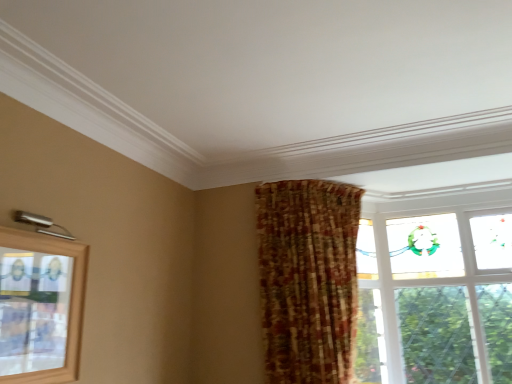
The width and height of the screenshot is (512, 384). Identify the location of plaid fabric curtain at center. (308, 279).

Considering the sizes of plaid fabric curtain at center and clear glass window at upper right, placed as the first window when sorted from right to left, in the image, is plaid fabric curtain at center bigger or smaller than clear glass window at upper right, placed as the first window when sorted from right to left,?

Considering their sizes, plaid fabric curtain at center takes up more space than clear glass window at upper right, placed as the first window when sorted from right to left.

Does plaid fabric curtain at center lie behind clear glass window at upper right, which appears as the 2th window when viewed from the front?

No, plaid fabric curtain at center is closer to the viewer.

Can you confirm if plaid fabric curtain at center is shorter than clear glass window at upper right, which appears as the 2th window when viewed from the front?

Correct, plaid fabric curtain at center is not as tall as clear glass window at upper right, which appears as the 2th window when viewed from the front.

You are a GUI agent. You are given a task and a screenshot of the screen. Output one action in this format:
    pyautogui.click(x=<x>, y=<y>)
    Task: Click on the curtain that appears on the left of clear glass window at upper right, which appears as the 2th window when viewed from the front
    The image size is (512, 384).
    Given the screenshot: What is the action you would take?
    pyautogui.click(x=308, y=279)

From the image's perspective, is clear glass window at upper right, which is the second window in left-to-right order, above plaid fabric curtain at center?

Incorrect, from the image's perspective, clear glass window at upper right, which is the second window in left-to-right order, is lower than plaid fabric curtain at center.

Can you confirm if clear glass window at upper right, which appears as the 2th window when viewed from the front, is smaller than plaid fabric curtain at center?

Indeed, clear glass window at upper right, which appears as the 2th window when viewed from the front, has a smaller size compared to plaid fabric curtain at center.

Which object is wider, clear glass window at upper right, the 1th window positioned from the back, or plaid fabric curtain at center?

plaid fabric curtain at center.

Is clear glass window at upper left, placed as the 1th window when sorted from left to right, inside the boundaries of clear glass window at upper right, which is the second window in left-to-right order, or outside?

clear glass window at upper left, placed as the 1th window when sorted from left to right, cannot be found inside clear glass window at upper right, which is the second window in left-to-right order.

Looking at this image, from the image's perspective, who appears lower, clear glass window at upper left, positioned as the 2th window in back-to-front order, or clear glass window at upper right, the 1th window positioned from the back?

clear glass window at upper right, the 1th window positioned from the back, from the image's perspective.

From a real-world perspective, is clear glass window at upper left, which appears as the 1th window when viewed from the front, physically below clear glass window at upper right, placed as the first window when sorted from right to left?

Yes, from a real-world perspective, clear glass window at upper left, which appears as the 1th window when viewed from the front, is under clear glass window at upper right, placed as the first window when sorted from right to left.

Could you measure the distance between clear glass window at upper left, positioned as the 2th window in back-to-front order, and clear glass window at upper right, placed as the first window when sorted from right to left?

clear glass window at upper left, positioned as the 2th window in back-to-front order, is 7.69 feet from clear glass window at upper right, placed as the first window when sorted from right to left.

Does clear glass window at upper right, placed as the first window when sorted from right to left, appear on the left side of clear glass window at upper left, positioned as the 2th window in back-to-front order?

Incorrect, clear glass window at upper right, placed as the first window when sorted from right to left, is not on the left side of clear glass window at upper left, positioned as the 2th window in back-to-front order.

Considering the relative positions of clear glass window at upper right, placed as the first window when sorted from right to left, and clear glass window at upper left, which appears as the 1th window when viewed from the front, in the image provided, is clear glass window at upper right, placed as the first window when sorted from right to left, in front of clear glass window at upper left, which appears as the 1th window when viewed from the front,?

That is False.

From the image's perspective, does clear glass window at upper right, placed as the first window when sorted from right to left, appear higher than clear glass window at upper left, placed as the 1th window when sorted from left to right?

No.

Is clear glass window at upper right, which appears as the 2th window when viewed from the front, inside or outside of clear glass window at upper left, the 2th window viewed from the right?

The correct answer is: outside.

Which object is positioned more to the left, plaid fabric curtain at center or clear glass window at upper left, which appears as the 1th window when viewed from the front?

clear glass window at upper left, which appears as the 1th window when viewed from the front, is more to the left.

The height and width of the screenshot is (384, 512). Identify the location of curtain on the right side of clear glass window at upper left, the 2th window viewed from the right. (308, 279).

From a real-world perspective, is plaid fabric curtain at center under clear glass window at upper left, the 2th window viewed from the right?

No, from a real-world perspective, plaid fabric curtain at center is not beneath clear glass window at upper left, the 2th window viewed from the right.

Is plaid fabric curtain at center facing towards clear glass window at upper left, positioned as the 2th window in back-to-front order?

No, plaid fabric curtain at center is not aimed at clear glass window at upper left, positioned as the 2th window in back-to-front order.

Is clear glass window at upper left, which appears as the 1th window when viewed from the front, beside plaid fabric curtain at center?

No, clear glass window at upper left, which appears as the 1th window when viewed from the front, is not with plaid fabric curtain at center.

Could you tell me if clear glass window at upper left, positioned as the 2th window in back-to-front order, is turned towards plaid fabric curtain at center?

No, clear glass window at upper left, positioned as the 2th window in back-to-front order, does not turn towards plaid fabric curtain at center.

Which of these two, clear glass window at upper left, positioned as the 2th window in back-to-front order, or plaid fabric curtain at center, is smaller?

clear glass window at upper left, positioned as the 2th window in back-to-front order.

Does point (68, 342) come closer to viewer compared to point (316, 303)?

Yes.

The image size is (512, 384). In order to click on window behind the plaid fabric curtain at center in this screenshot , I will do `click(437, 295)`.

Find the location of `window that appears on the right of plaid fabric curtain at center`. window that appears on the right of plaid fabric curtain at center is located at coordinates (437, 295).

From the image, which object appears to be farther from clear glass window at upper right, which appears as the 2th window when viewed from the front, clear glass window at upper left, which appears as the 1th window when viewed from the front, or plaid fabric curtain at center?

clear glass window at upper left, which appears as the 1th window when viewed from the front, is further to clear glass window at upper right, which appears as the 2th window when viewed from the front.

Looking at this image, which object lies further to the anchor point clear glass window at upper right, the 1th window positioned from the back, plaid fabric curtain at center or clear glass window at upper left, the 2th window viewed from the right?

clear glass window at upper left, the 2th window viewed from the right, lies further to clear glass window at upper right, the 1th window positioned from the back, than the other object.

In the scene shown: Based on their spatial positions, is clear glass window at upper right, placed as the first window when sorted from right to left, or plaid fabric curtain at center further from clear glass window at upper left, positioned as the 2th window in back-to-front order?

Based on the image, clear glass window at upper right, placed as the first window when sorted from right to left, appears to be further to clear glass window at upper left, positioned as the 2th window in back-to-front order.

Which object lies further to the anchor point plaid fabric curtain at center, clear glass window at upper right, which appears as the 2th window when viewed from the front, or clear glass window at upper left, positioned as the 2th window in back-to-front order?

clear glass window at upper left, positioned as the 2th window in back-to-front order, is further to plaid fabric curtain at center.

Based on their spatial positions, is plaid fabric curtain at center or clear glass window at upper right, the 1th window positioned from the back, further from clear glass window at upper left, which appears as the 1th window when viewed from the front?

Based on the image, clear glass window at upper right, the 1th window positioned from the back, appears to be further to clear glass window at upper left, which appears as the 1th window when viewed from the front.

From the image, which object appears to be nearer to plaid fabric curtain at center, clear glass window at upper left, placed as the 1th window when sorted from left to right, or clear glass window at upper right, which is the second window in left-to-right order?

clear glass window at upper right, which is the second window in left-to-right order, lies closer to plaid fabric curtain at center than the other object.

Locate an element on the screen. Image resolution: width=512 pixels, height=384 pixels. curtain located between clear glass window at upper left, placed as the 1th window when sorted from left to right, and clear glass window at upper right, placed as the first window when sorted from right to left, in the left-right direction is located at coordinates (308, 279).